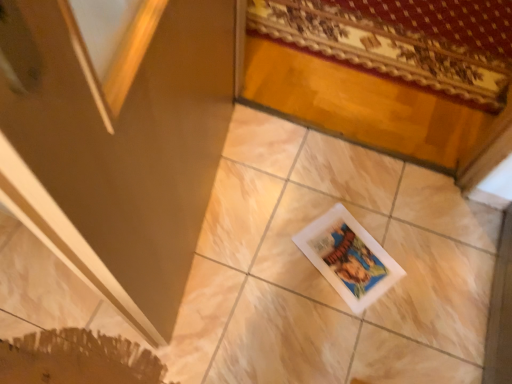
You are a GUI agent. You are given a task and a screenshot of the screen. Output one action in this format:
    pyautogui.click(x=<x>, y=<y>)
    Task: Click on the white matte picture frame at center
    The width and height of the screenshot is (512, 384).
    Given the screenshot: What is the action you would take?
    pos(349,258)

I want to click on matte brown screen door at lower left, so click(117, 138).

The height and width of the screenshot is (384, 512). What do you see at coordinates (384, 48) in the screenshot?
I see `patterned fabric mat at upper right` at bounding box center [384, 48].

Locate an element on the screen. This screenshot has height=384, width=512. white matte picture frame at center is located at coordinates 349,258.

Considering the relative sizes of matte brown screen door at lower left and white matte picture frame at center in the image provided, is matte brown screen door at lower left bigger than white matte picture frame at center?

Yes, matte brown screen door at lower left is bigger than white matte picture frame at center.

From a real-world perspective, is matte brown screen door at lower left on white matte picture frame at center?

Yes.

How many degrees apart are the facing directions of matte brown screen door at lower left and white matte picture frame at center?

There is a 138-degree angle between the facing directions of matte brown screen door at lower left and white matte picture frame at center.

How far apart are matte brown screen door at lower left and white matte picture frame at center?

matte brown screen door at lower left and white matte picture frame at center are 25.58 inches apart.

From a real-world perspective, who is located higher, patterned fabric mat at upper right or matte brown screen door at lower left?

matte brown screen door at lower left, from a real-world perspective.

Does patterned fabric mat at upper right have a smaller size compared to matte brown screen door at lower left?

Yes.

In the scene shown: From the image's perspective, is patterned fabric mat at upper right on matte brown screen door at lower left?

Yes, from the image's perspective, patterned fabric mat at upper right is on top of matte brown screen door at lower left.

Consider the image. Is patterned fabric mat at upper right surrounding matte brown screen door at lower left?

No.

Is matte brown screen door at lower left positioned with its back to patterned fabric mat at upper right?

No, matte brown screen door at lower left is not facing away from patterned fabric mat at upper right.

From the picture: From the image's perspective, which is below, matte brown screen door at lower left or patterned fabric mat at upper right?

matte brown screen door at lower left appears lower in the image.

Consider the image. Does matte brown screen door at lower left come behind patterned fabric mat at upper right?

No, the depth of matte brown screen door at lower left is less than that of patterned fabric mat at upper right.

Does point (162, 83) lie behind point (447, 67)?

No, it is in front of (447, 67).

How different are the orientations of patterned fabric mat at upper right and white matte picture frame at center in degrees?

29.5 degrees.

Could you tell me if patterned fabric mat at upper right is facing white matte picture frame at center?

Yes, patterned fabric mat at upper right is facing white matte picture frame at center.

Is point (478, 71) closer to camera compared to point (375, 273)?

No, (478, 71) is behind (375, 273).

Is matte brown screen door at lower left surrounded by white matte picture frame at center?

No, matte brown screen door at lower left is not surrounded by white matte picture frame at center.

Can you tell me how much white matte picture frame at center and matte brown screen door at lower left differ in facing direction?

The angle between the facing direction of white matte picture frame at center and the facing direction of matte brown screen door at lower left is 138 degrees.

Is point (326, 243) closer to viewer compared to point (73, 259)?

No.

Is white matte picture frame at center looking in the opposite direction of matte brown screen door at lower left?

No.

Which object is more forward, white matte picture frame at center or patterned fabric mat at upper right?

white matte picture frame at center.

Considering the relative sizes of white matte picture frame at center and patterned fabric mat at upper right in the image provided, is white matte picture frame at center wider than patterned fabric mat at upper right?

No, white matte picture frame at center is not wider than patterned fabric mat at upper right.

Where is `picture frame located underneath the patterned fabric mat at upper right (from a real-world perspective)`? This screenshot has height=384, width=512. picture frame located underneath the patterned fabric mat at upper right (from a real-world perspective) is located at coordinates (349, 258).

Considering the relative sizes of white matte picture frame at center and patterned fabric mat at upper right in the image provided, is white matte picture frame at center shorter than patterned fabric mat at upper right?

Correct, white matte picture frame at center is not as tall as patterned fabric mat at upper right.

The height and width of the screenshot is (384, 512). There is a white matte picture frame at center. Identify the location of screen door above it (from a real-world perspective). (117, 138).

The width and height of the screenshot is (512, 384). Identify the location of screen door in front of the patterned fabric mat at upper right. (117, 138).

Based on their spatial positions, is matte brown screen door at lower left or patterned fabric mat at upper right closer to white matte picture frame at center?

Based on the image, matte brown screen door at lower left appears to be nearer to white matte picture frame at center.

Based on their spatial positions, is white matte picture frame at center or patterned fabric mat at upper right further from matte brown screen door at lower left?

Based on the image, patterned fabric mat at upper right appears to be further to matte brown screen door at lower left.

Considering their positions, is white matte picture frame at center positioned closer to patterned fabric mat at upper right than matte brown screen door at lower left?

Among the two, white matte picture frame at center is located nearer to patterned fabric mat at upper right.

Based on their spatial positions, is patterned fabric mat at upper right or matte brown screen door at lower left closer to white matte picture frame at center?

Based on the image, matte brown screen door at lower left appears to be nearer to white matte picture frame at center.

Looking at the image, which one is located further to matte brown screen door at lower left, patterned fabric mat at upper right or white matte picture frame at center?

The object further to matte brown screen door at lower left is patterned fabric mat at upper right.

Looking at the image, which one is located closer to patterned fabric mat at upper right, matte brown screen door at lower left or white matte picture frame at center?

white matte picture frame at center is closer to patterned fabric mat at upper right.

This screenshot has height=384, width=512. Identify the location of picture frame located between matte brown screen door at lower left and patterned fabric mat at upper right in the depth direction. (349, 258).